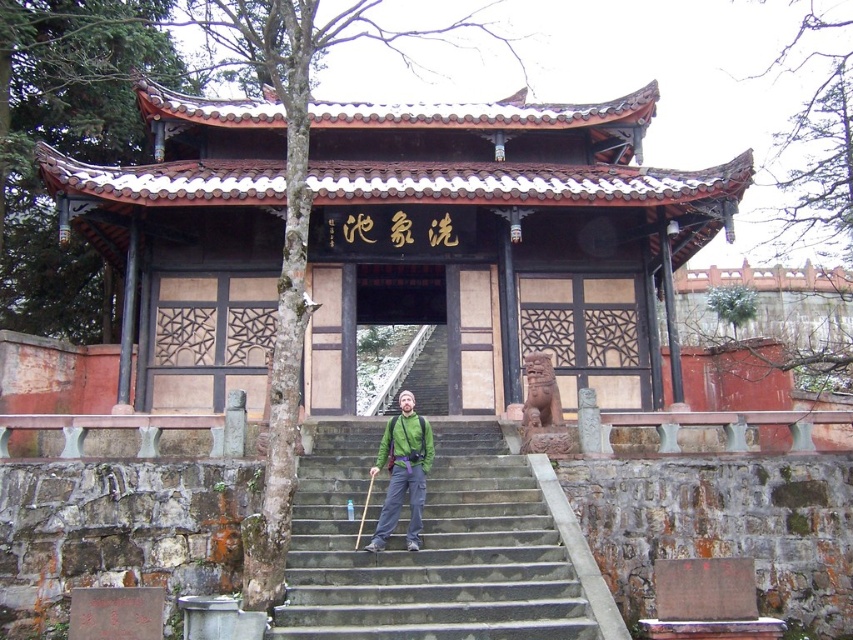
You are a GUI agent. You are given a task and a screenshot of the screen. Output one action in this format:
    pyautogui.click(x=<x>, y=<y>)
    Task: Click on the gray stone stairs at center
    
    Given the screenshot: What is the action you would take?
    pyautogui.click(x=427, y=547)

Is gray stone stairs at center positioned at the back of green fabric backpack at center?

No, it is in front of green fabric backpack at center.

Which is behind, point (306, 637) or point (432, 444)?

The point (432, 444) is more distant.

Identify the location of gray stone stairs at center. (427, 547).